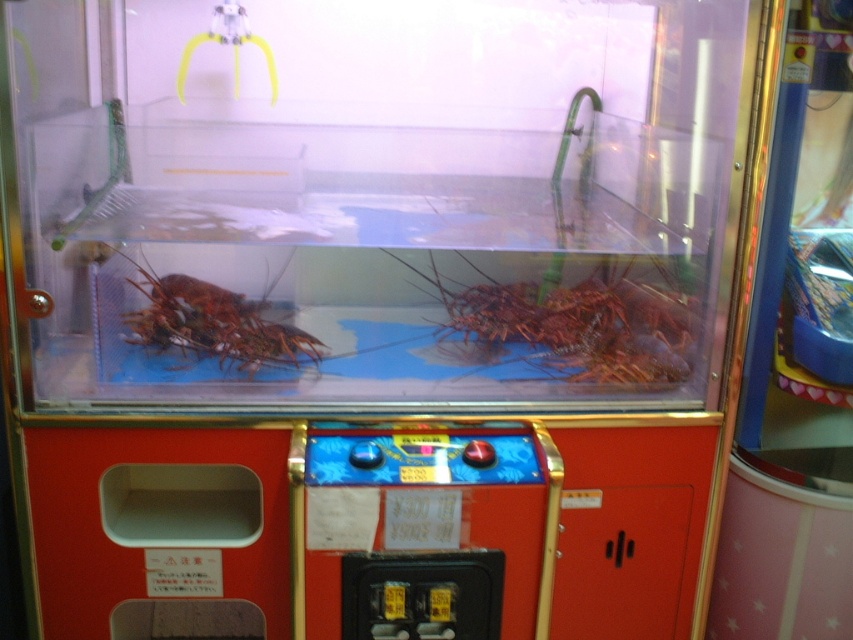
Looking at this image, is shiny red lobster at center below red matte lobster at left?

No, shiny red lobster at center is not below red matte lobster at left.

Is point (619, 365) less distant than point (183, 282)?

Yes.

What do you see at coordinates (576, 324) in the screenshot?
I see `shiny red lobster at center` at bounding box center [576, 324].

Identify the location of shiny red lobster at center. The width and height of the screenshot is (853, 640). (576, 324).